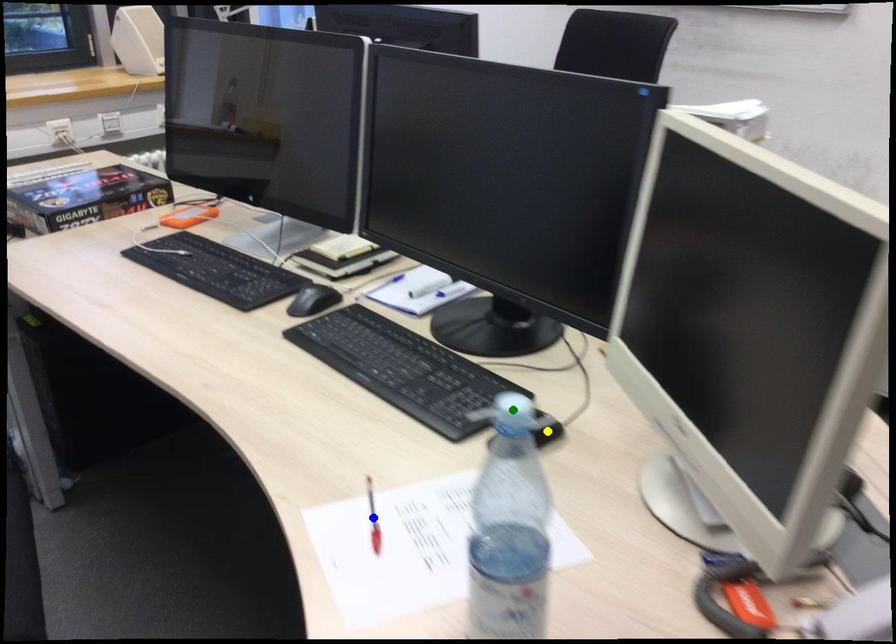
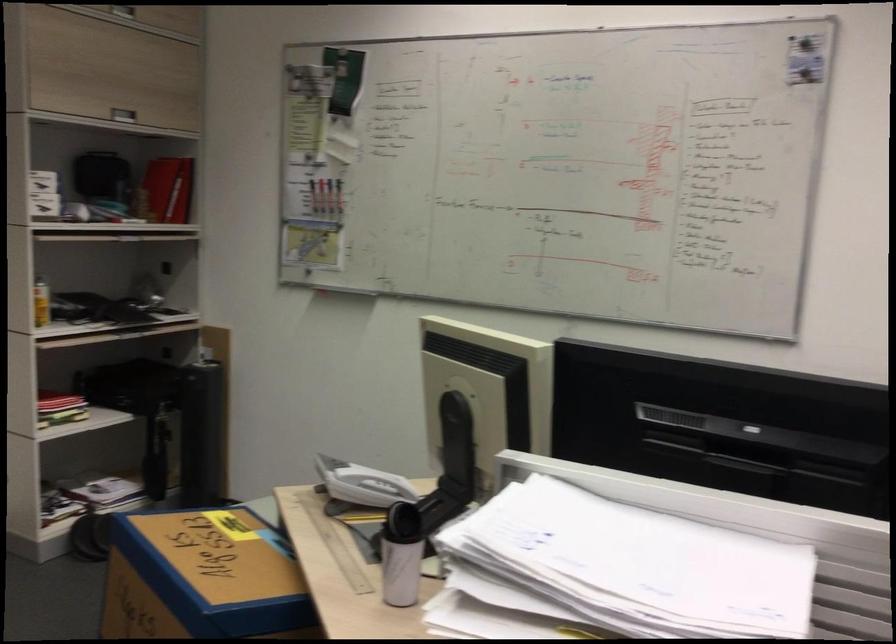
I am providing you with two images of the same scene from different viewpoints. Three points are marked in image1. Which point corresponds to a part or object that is occluded in image2?In image1, three points are marked. Which of them correspond to a part or object that is occluded in image2?Among the three points shown in image1, which one corresponds to a part or object that is no longer visible due to occlusion in image2?

green point, blue point, yellow point